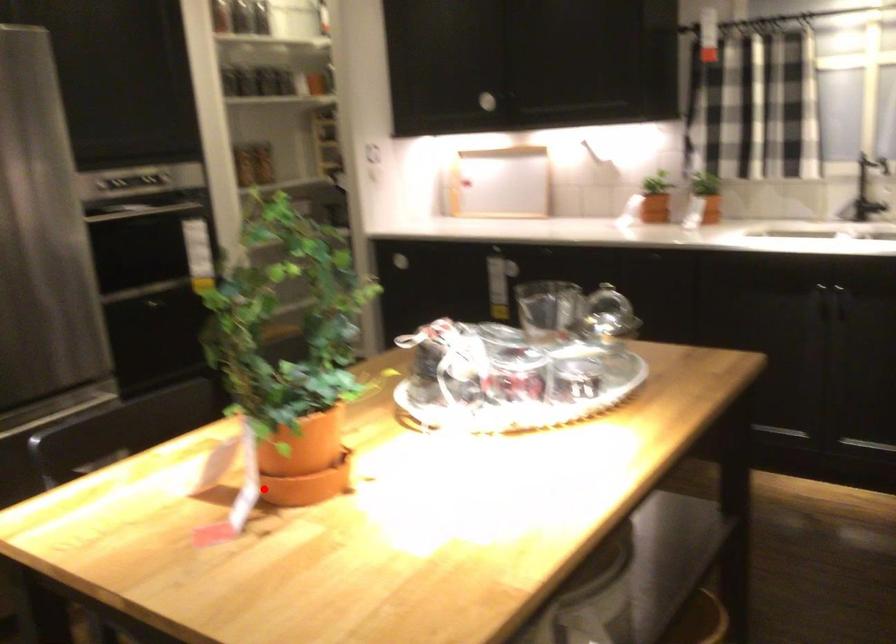
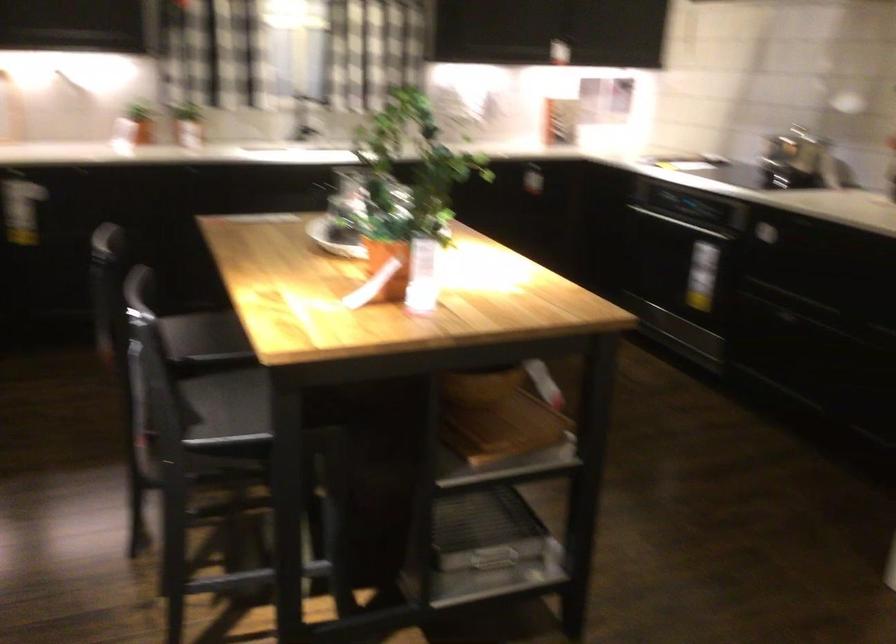
In the second image, find the point that corresponds to the highlighted location in the first image.

(424, 275)